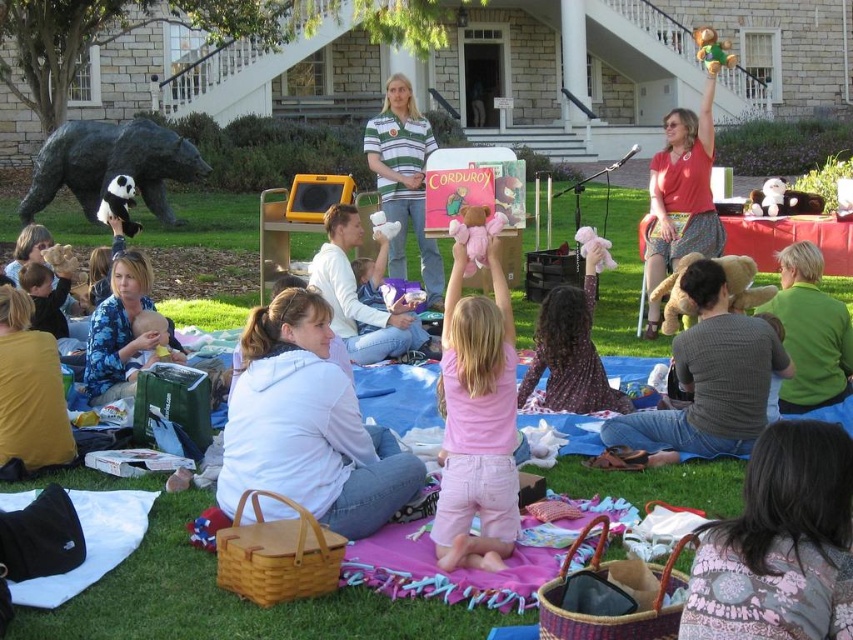
You are a photographer trying to capture a closeup of the pink plush bear at center without the pink fabric dress at center blocking the view. Is it possible to do so?

Answer: The pink fabric dress at center might be wider than the pink plush bear at center, so there is a possibility that the dress could block the view of the bear. To ensure a clear shot, the photographer should adjust their angle or position to avoid the dress.

You are a photographer trying to capture both the green fuzzy sweater at lower right and the green plush bear at upper center in the same frame. Which object should you focus on first to ensure both are in the shot?

The green fuzzy sweater at lower right is smaller in size than the green plush bear at upper center. To ensure both are in the shot, focus on positioning the camera so the larger green plush bear at upper center is centered, then adjust to include the smaller green fuzzy sweater at lower right.